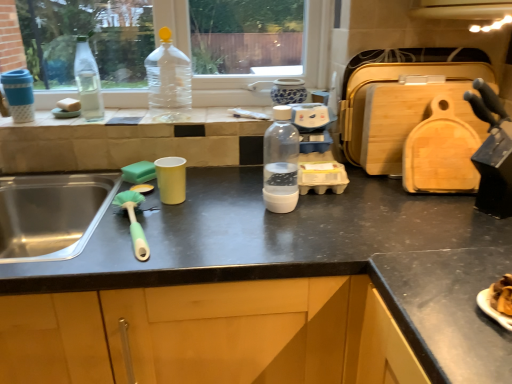
Where is `free space that is in between white sponge at left, placed as the first food when sorted from back to front, and transparent plastic bottle at upper center, arranged as the second bottle when viewed from the front`? Image resolution: width=512 pixels, height=384 pixels. free space that is in between white sponge at left, placed as the first food when sorted from back to front, and transparent plastic bottle at upper center, arranged as the second bottle when viewed from the front is located at coordinates (116, 116).